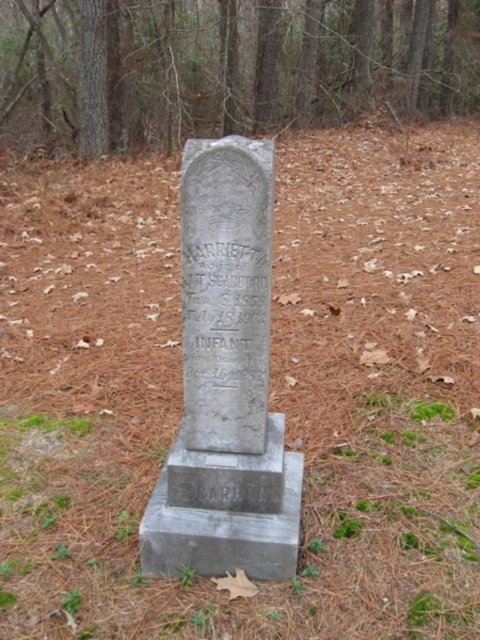
Question: Is smooth gray stone at center closer to camera compared to gray stone gravestone at center?

Choices:
 (A) yes
 (B) no

Answer: (B)

Question: Considering the relative positions of smooth gray stone at center and gray stone gravestone at center in the image provided, where is smooth gray stone at center located with respect to gray stone gravestone at center?

Choices:
 (A) left
 (B) right

Answer: (B)

Question: Among these points, which one is nearest to the camera?

Choices:
 (A) (259, 381)
 (B) (19, 83)

Answer: (A)

Question: Which point is farther to the camera?

Choices:
 (A) (14, 104)
 (B) (200, 388)

Answer: (A)

Question: Is smooth gray stone at center smaller than gray stone gravestone at center?

Choices:
 (A) yes
 (B) no

Answer: (B)